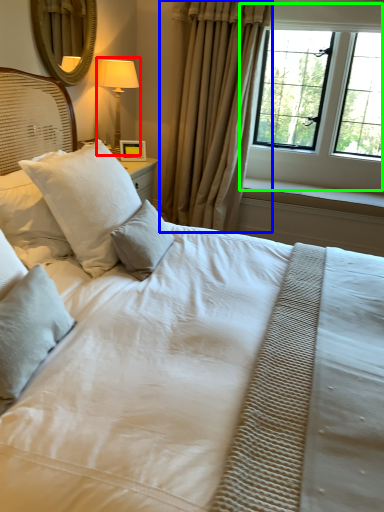
Question: Which is nearer to the bedside lamp (highlighted by a red box)? curtain (highlighted by a blue box) or window (highlighted by a green box).

Choices:
 (A) curtain
 (B) window

Answer: (A)